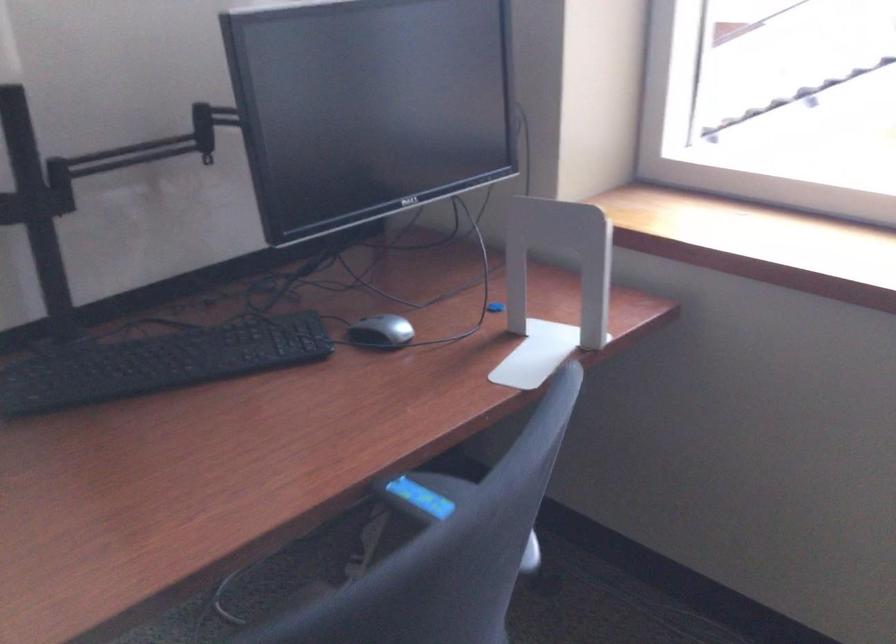
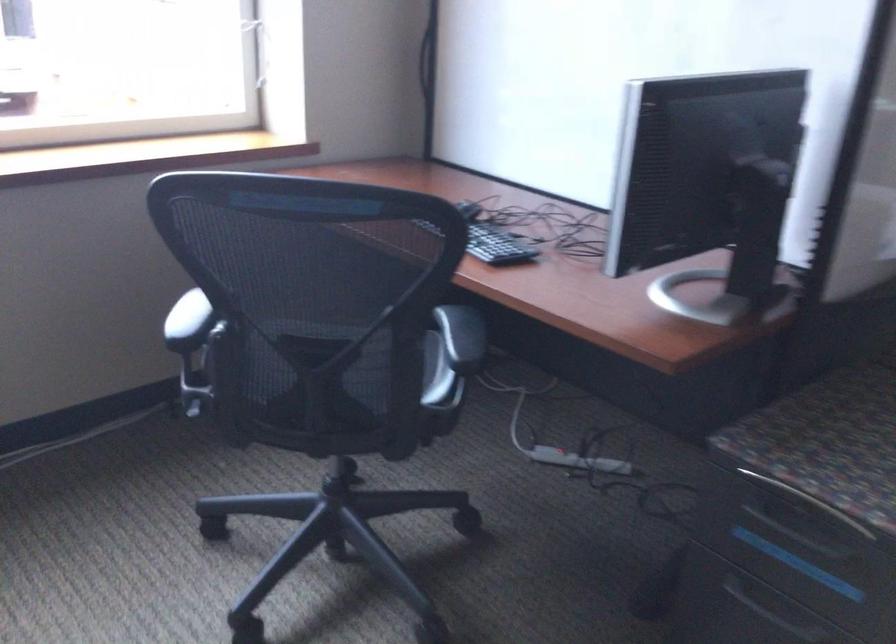
Question: I am providing you with two images of the same scene from different viewpoints. Please identify which objects are invisible in image2.

Choices:
 (A) black keyboard
 (B) white bookend
 (C) recessed drawer handle
 (D) folded white booklet

Answer: (B)